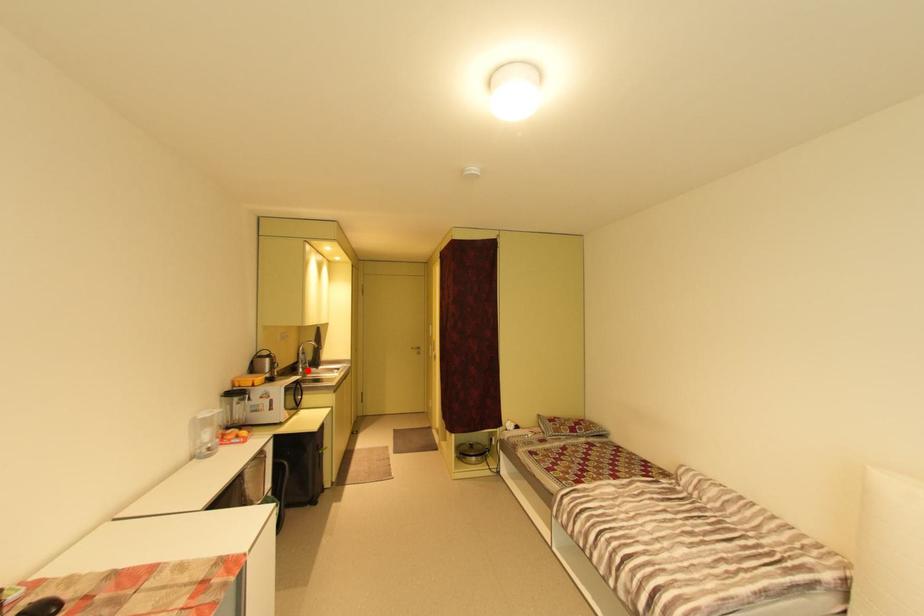
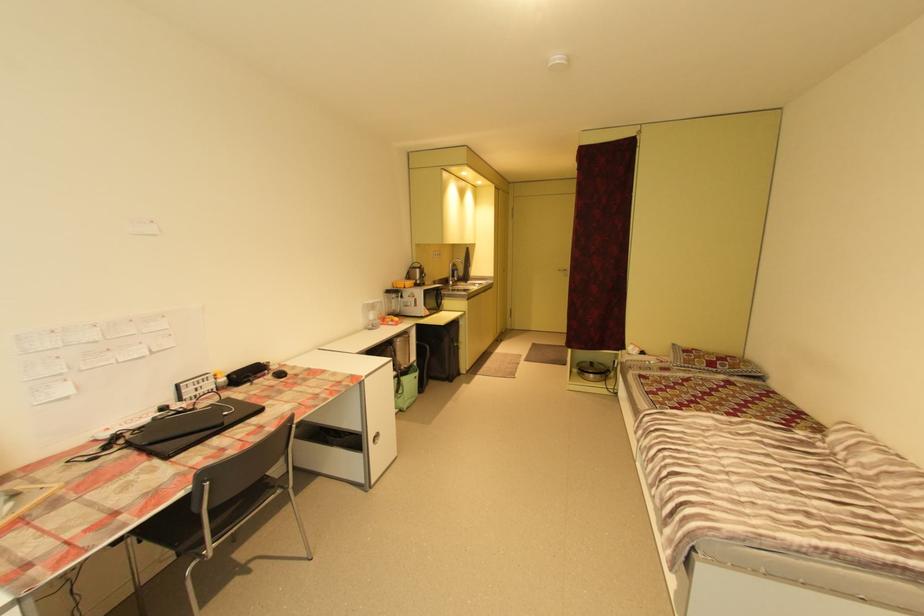
Locate, in the second image, the point that corresponds to the highlighted location in the first image.

(457, 284)